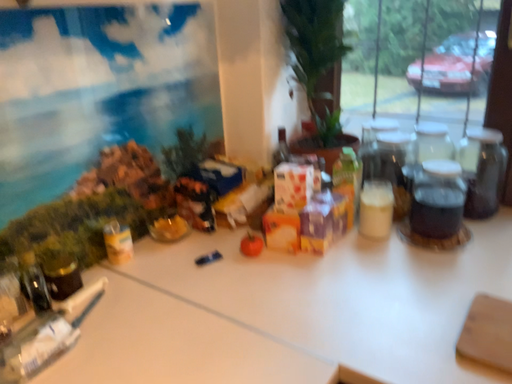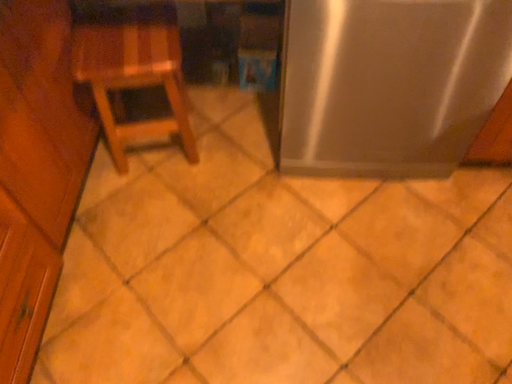
Question: How did the camera likely rotate when shooting the video?

Choices:
 (A) rotated downward
 (B) rotated upward

Answer: (A)